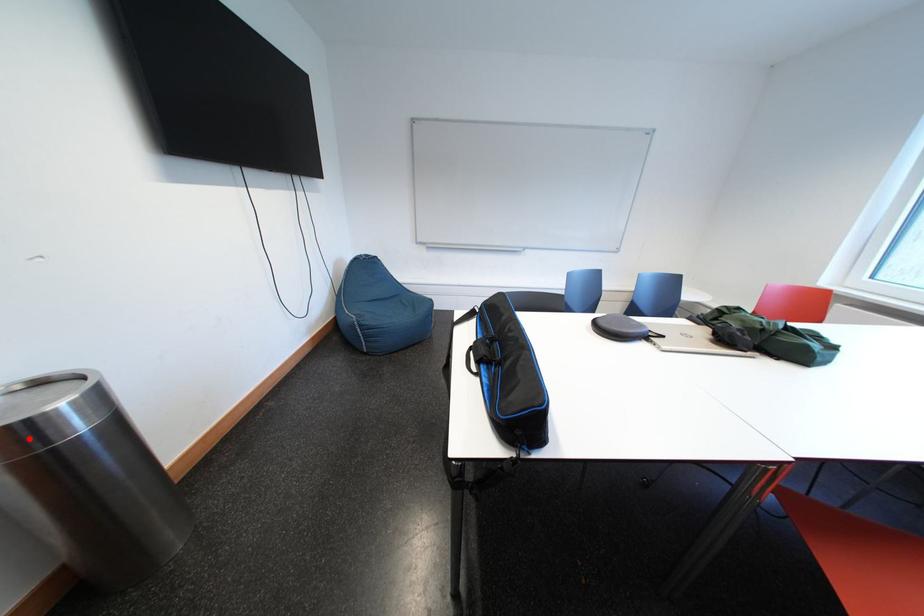
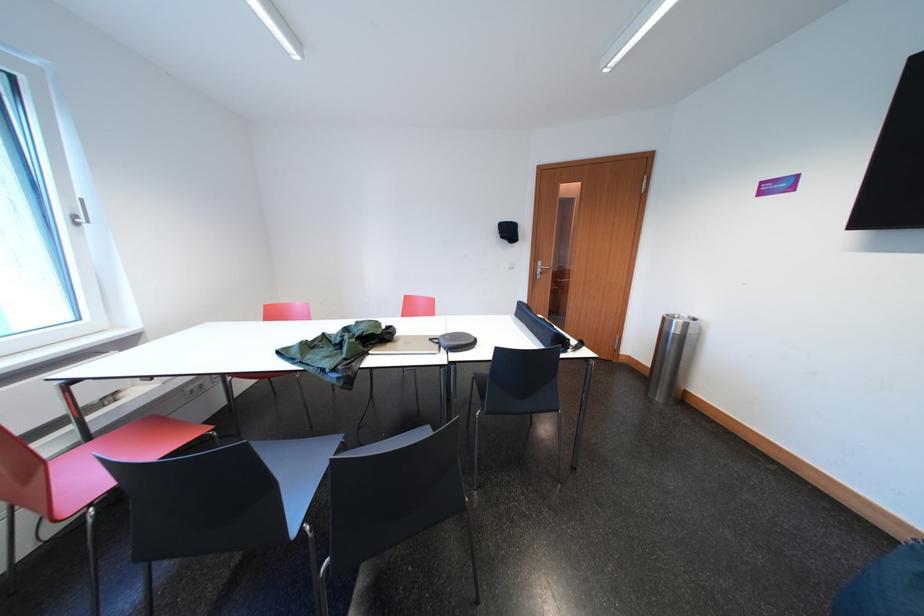
Locate, in the second image, the point that corresponds to the highlighted location in the first image.

(672, 323)